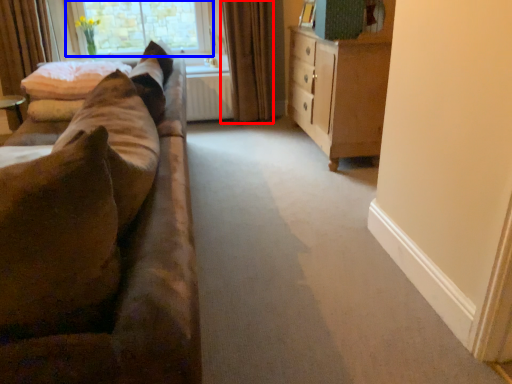
Question: Which point is further to the camera, curtain (highlighted by a red box) or window (highlighted by a blue box)?

Choices:
 (A) curtain
 (B) window

Answer: (B)